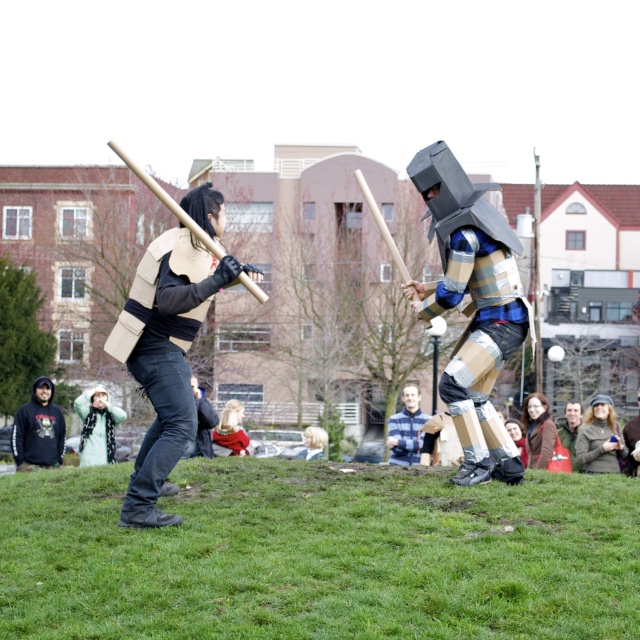
Question: Among these points, which one is nearest to the camera?

Choices:
 (A) (35, 435)
 (B) (97, 396)
 (C) (404, 436)
 (D) (614, 458)

Answer: (D)

Question: In this image, where is dark gray hoodie at lower left located relative to blue plaid shirt at center?

Choices:
 (A) above
 (B) below

Answer: (B)

Question: Which object is positioned closest to the blue plaid shirt at center?

Choices:
 (A) green wool scarf at lower left
 (B) green woolen hat at lower right
 (C) matte cardboard vest at left

Answer: (B)

Question: Can you confirm if green grass at lower center is thinner than dark gray hoodie at lower left?

Choices:
 (A) no
 (B) yes

Answer: (A)

Question: Can you confirm if matte cardboard vest at left is positioned to the right of dark gray hoodie at lower left?

Choices:
 (A) yes
 (B) no

Answer: (A)

Question: Which object is positioned closest to the green woolen hat at lower right?

Choices:
 (A) green wool scarf at lower left
 (B) blue plaid shirt at center

Answer: (B)